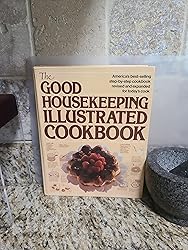
Identify the location of stone countertop. The width and height of the screenshot is (188, 250). (94, 223).